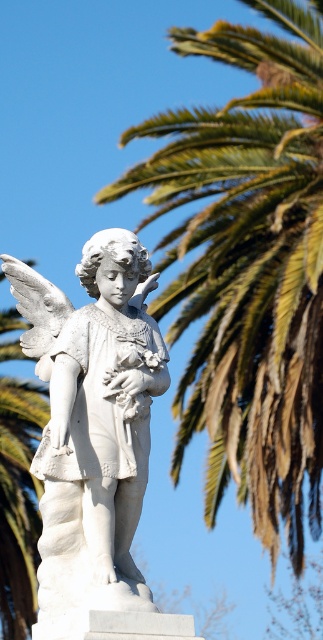
Question: Among these points, which one is nearest to the camera?

Choices:
 (A) (42, 554)
 (B) (290, 369)

Answer: (A)

Question: Among these points, which one is farthest from the camera?

Choices:
 (A) (287, 8)
 (B) (126, 298)

Answer: (A)

Question: Can you confirm if green leafy palm at upper right is positioned below white marble statue at center?

Choices:
 (A) no
 (B) yes

Answer: (A)

Question: Can you confirm if green leafy palm at upper right is positioned above white marble statue at center?

Choices:
 (A) no
 (B) yes

Answer: (B)

Question: Is green leafy palm at upper right positioned behind white marble statue at center?

Choices:
 (A) no
 (B) yes

Answer: (B)